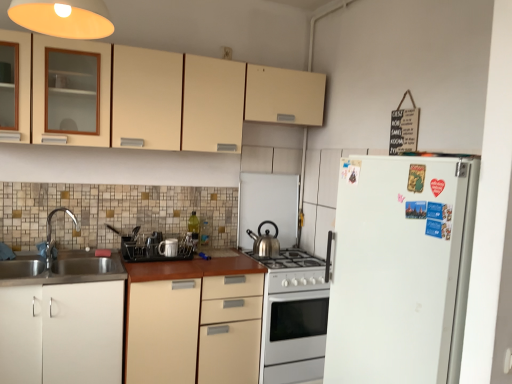
This screenshot has width=512, height=384. Identify the location of free space in front of polished stainless steel kettle at center. (270, 261).